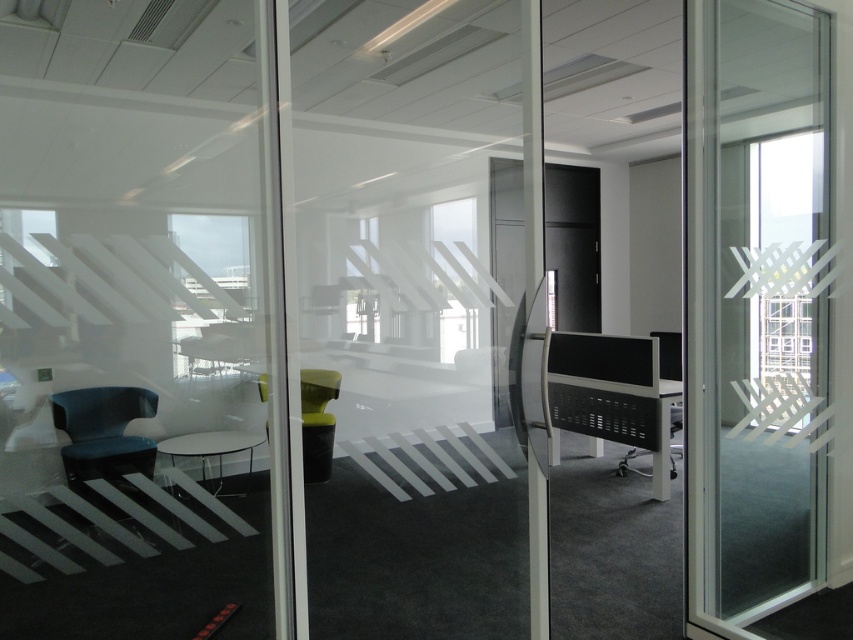
Can you confirm if matte blue chair at lower left is taller than green fabric chair at center?

In fact, matte blue chair at lower left may be shorter than green fabric chair at center.

Is matte blue chair at lower left closer to camera compared to green fabric chair at center?

That is True.

Between point (148, 400) and point (305, 435), which one is positioned behind?

Point (305, 435)

This screenshot has height=640, width=853. Find the location of `matte blue chair at lower left`. matte blue chair at lower left is located at coordinates (103, 432).

Is transparent glass screen door at right further to camera compared to matte blue chair at lower left?

No, it is not.

Is transparent glass screen door at right to the left of matte blue chair at lower left from the viewer's perspective?

In fact, transparent glass screen door at right is to the right of matte blue chair at lower left.

Is point (801, 449) farther from camera compared to point (93, 456)?

That is False.

I want to click on transparent glass screen door at right, so click(756, 307).

Does transparent glass screen door at right appear on the right side of matte black chair at right?

In fact, transparent glass screen door at right is to the left of matte black chair at right.

Does transparent glass screen door at right have a larger size compared to matte black chair at right?

Indeed, transparent glass screen door at right has a larger size compared to matte black chair at right.

Is point (792, 52) positioned before point (672, 465)?

Yes, it is in front of point (672, 465).

At what (x,y) coordinates should I click in order to perform the action: click on transparent glass screen door at right. Please return your answer as a coordinate pair (x, y). This screenshot has width=853, height=640. Looking at the image, I should click on (756, 307).